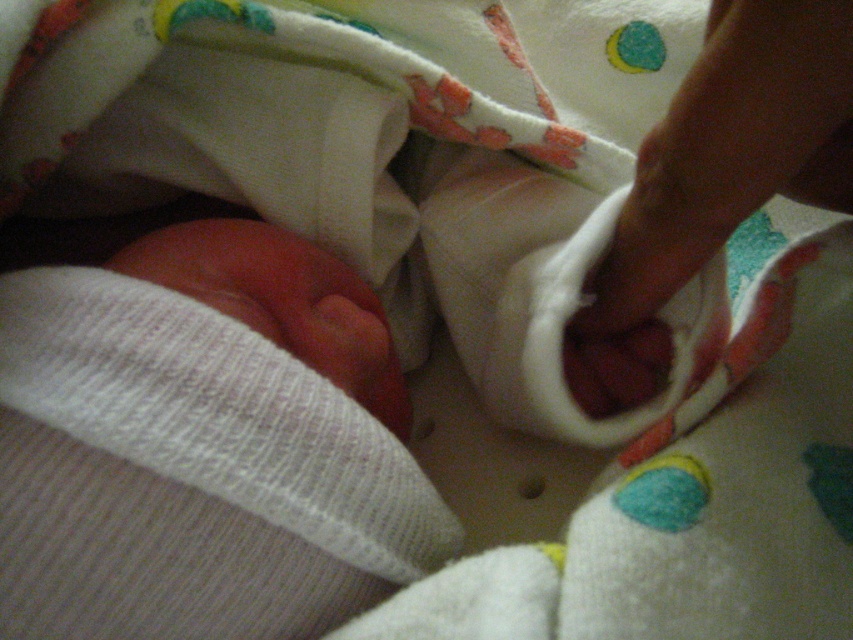
Which is in front, point (688, 182) or point (229, 259)?

Point (688, 182) is in front.

Is smooth skin hand at center positioned at the back of pink soft skin at center?

No.

Does point (686, 243) come closer to viewer compared to point (204, 259)?

That is True.

Locate an element on the screen. This screenshot has height=640, width=853. smooth skin hand at center is located at coordinates (730, 150).